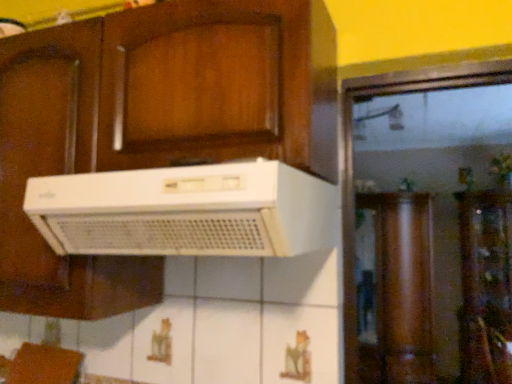
Question: From the image's perspective, is transparent glass cabinet at center above or below white plastic range hood at center?

Choices:
 (A) above
 (B) below

Answer: (B)

Question: Relative to white plastic range hood at center, is transparent glass cabinet at center in front or behind?

Choices:
 (A) front
 (B) behind

Answer: (B)

Question: Based on their positions, is transparent glass cabinet at center located to the left or right of white plastic range hood at center?

Choices:
 (A) left
 (B) right

Answer: (B)

Question: Is point [x=32, y=188] closer or farther from the camera than point [x=503, y=271]?

Choices:
 (A) farther
 (B) closer

Answer: (B)

Question: Based on their positions, is white plastic range hood at center located to the left or right of transparent glass cabinet at center?

Choices:
 (A) right
 (B) left

Answer: (B)

Question: Considering the positions of white plastic range hood at center and transparent glass cabinet at center in the image, is white plastic range hood at center wider or thinner than transparent glass cabinet at center?

Choices:
 (A) thin
 (B) wide

Answer: (A)

Question: Looking at the image, does white plastic range hood at center seem bigger or smaller compared to transparent glass cabinet at center?

Choices:
 (A) small
 (B) big

Answer: (A)